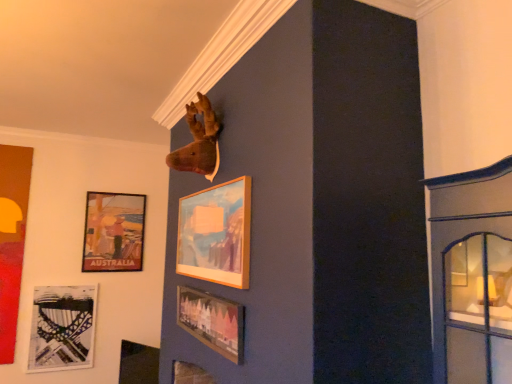
Question: From a real-world perspective, is matte black harp at lower left, which is counted as the second picture frame, starting from the back, above or below matte wooden picture frame at lower center, which is the 1th picture frame from front to back?

Choices:
 (A) above
 (B) below

Answer: (B)

Question: Choose the correct answer: Is matte black harp at lower left, which is counted as the second picture frame, starting from the back, inside matte wooden picture frame at lower center, arranged as the 5th picture frame when viewed from the back, or outside it?

Choices:
 (A) outside
 (B) inside

Answer: (A)

Question: Considering the real-world distances, which object is farthest from the matte black picture frame at lower left, acting as the 3th picture frame starting from the front?

Choices:
 (A) matte cardboard poster at upper left, placed as the fifth picture frame when sorted from front to back
 (B) matte black harp at lower left, the 4th picture frame in the front-to-back sequence
 (C) wooden frame at upper center, the 2th picture frame viewed from the front
 (D) matte wooden picture frame at lower center, which is the 1th picture frame from front to back

Answer: (C)

Question: Which is nearer to the matte cardboard poster at upper left, placed as the fifth picture frame when sorted from front to back?

Choices:
 (A) matte black picture frame at lower left, which is the 3th picture frame in back-to-front order
 (B) matte wooden picture frame at lower center, arranged as the 5th picture frame when viewed from the back
 (C) matte black harp at lower left, which is counted as the second picture frame, starting from the back
 (D) wooden frame at upper center, which appears as the 4th picture frame when viewed from the back

Answer: (C)